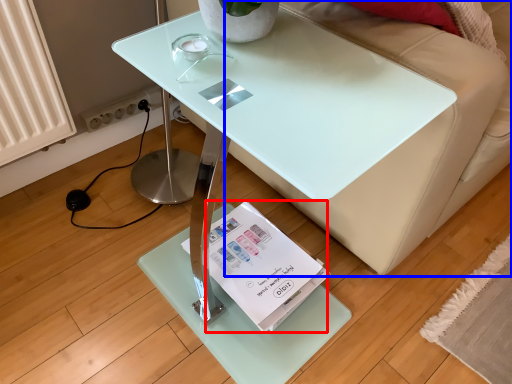
Question: Which of the following is the closest to the observer, magazine (highlighted by a red box) or couch (highlighted by a blue box)?

Choices:
 (A) magazine
 (B) couch

Answer: (B)